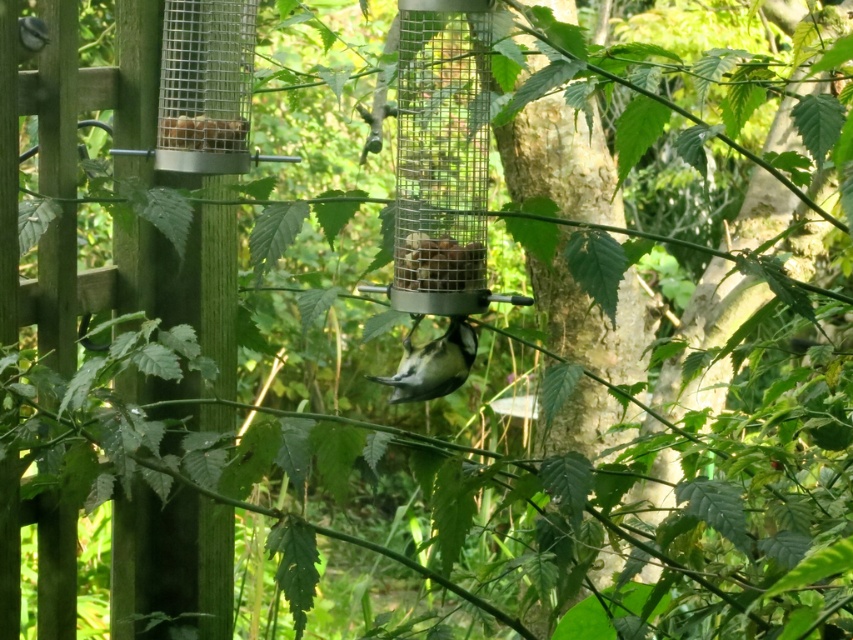
You are a small bird trying to reach the seeds in the metal mesh bird feeder at center. From your perspective, is the brown textured bird feeder at center blocking your view of the feeder? Please explain why or why not.

The metal mesh bird feeder at center is in front of the brown textured bird feeder at center, so the brown textured bird feeder at center is not blocking your view. You can see the metal mesh bird feeder at center clearly because it is positioned in front.

You are a birdwatcher observing the scene. You notice the metal mesh bird feeder at center and the white matte bird at center. Which object is taller?

The metal mesh bird feeder at center is taller than the white matte bird at center.

You are a small bird looking for a place to feed. You see the brown textured bird feeder at center and the metal mesh container at upper left. Which one is located below the other?

The brown textured bird feeder at center is positioned under the metal mesh container at upper left, so the brown textured bird feeder at center is below the metal mesh container at upper left.